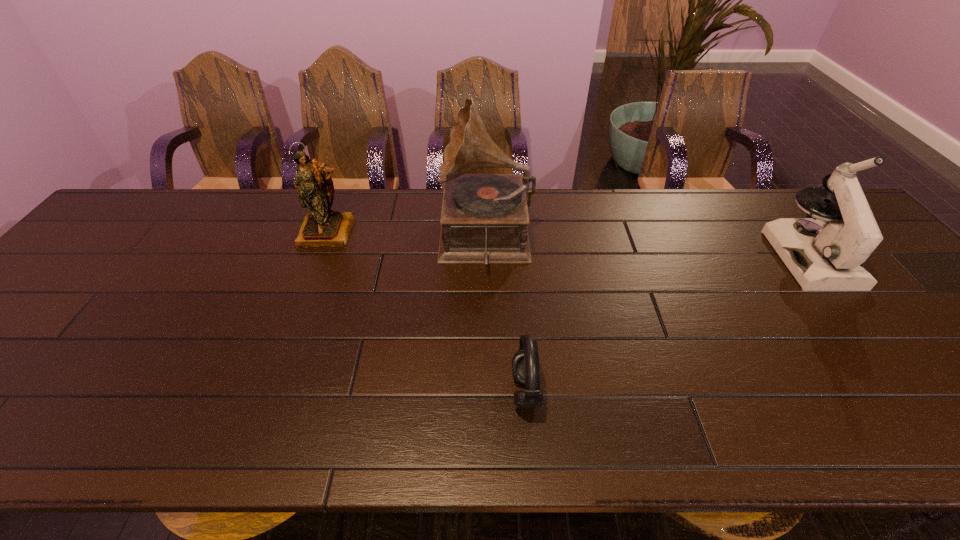
This screenshot has width=960, height=540. Find the location of `vacant area at the left edge of the desktop`. vacant area at the left edge of the desktop is located at coordinates (92, 295).

Locate an element on the screen. free region at the right edge of the desktop is located at coordinates (900, 348).

I want to click on blank space at the far left corner, so click(179, 204).

I want to click on empty space that is in between the tallest object and the headset, so click(x=506, y=316).

At what (x,y) coordinates should I click in order to perform the action: click on free space between the rightmost object and the nearest object. Please return your answer as a coordinate pair (x, y). Looking at the image, I should click on (668, 325).

At what (x,y) coordinates should I click in order to perform the action: click on vacant point located between the rightmost object and the leftmost object. Please return your answer as a coordinate pair (x, y). Looking at the image, I should click on (569, 245).

Locate an element on the screen. vacant space in between the headset and the record player is located at coordinates (506, 316).

I want to click on free spot between the leftmost object and the microscope, so click(x=569, y=245).

Locate an element on the screen. The height and width of the screenshot is (540, 960). unoccupied position between the leftmost object and the nearest object is located at coordinates (427, 312).

Locate an element on the screen. The width and height of the screenshot is (960, 540). blank region between the record player and the microscope is located at coordinates (648, 248).